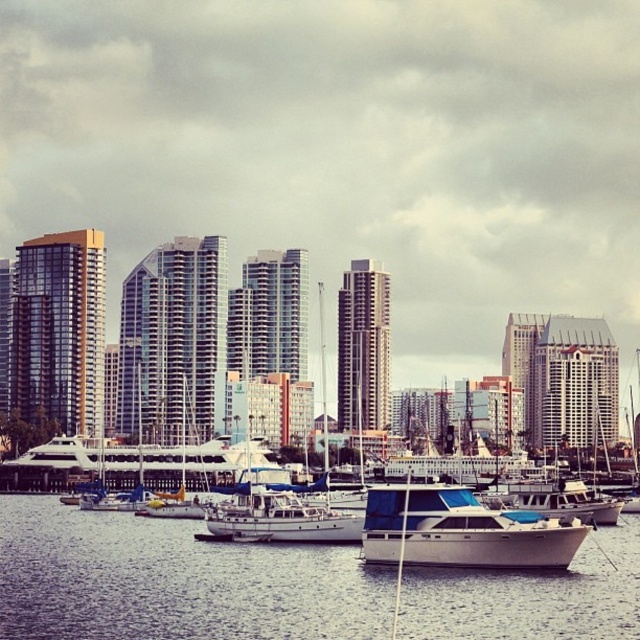
Question: Is white glossy boat at center positioned in front of white glossy sailboat at center?

Choices:
 (A) yes
 (B) no

Answer: (A)

Question: Can you confirm if white matte water at center is smaller than white glossy sailboat at center?

Choices:
 (A) yes
 (B) no

Answer: (B)

Question: Which object is closer to the camera taking this photo?

Choices:
 (A) white glossy sailboat at center
 (B) white matte water at center
 (C) white glossy boat at center

Answer: (B)

Question: Which object is the farthest from the white glossy sailboat at center?

Choices:
 (A) white glossy boat at center
 (B) white matte water at center

Answer: (A)

Question: Does white glossy boat at center lie in front of white glossy sailboat at center?

Choices:
 (A) yes
 (B) no

Answer: (A)

Question: Considering the real-world distances, which object is closest to the white matte water at center?

Choices:
 (A) white glossy sailboat at center
 (B) white glossy boat at center

Answer: (B)